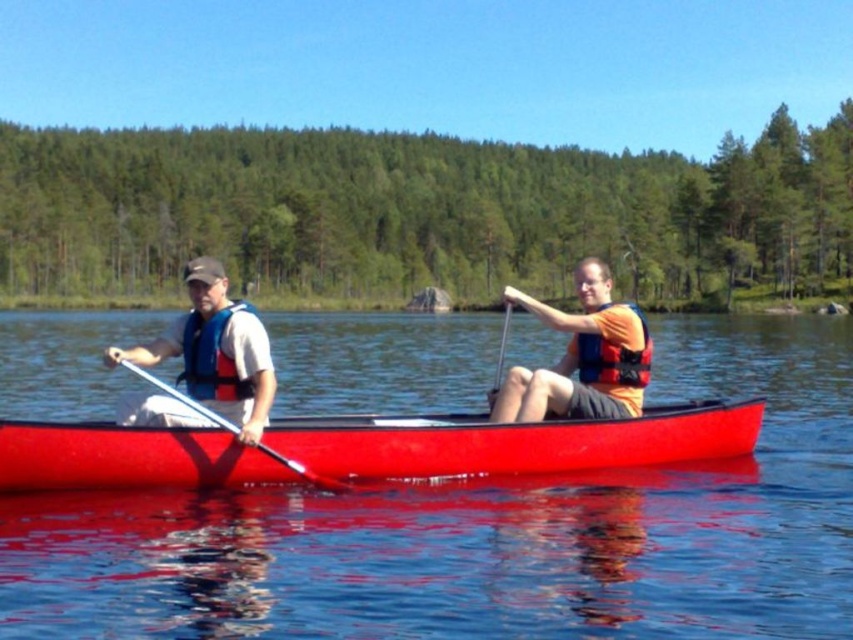
Question: Does matte blue life vest at left come in front of orange fabric life jacket at center?

Choices:
 (A) yes
 (B) no

Answer: (A)

Question: Which object is closer to the camera taking this photo?

Choices:
 (A) blue fabric life jacket at left
 (B) orange fabric life jacket at center
 (C) matte blue life vest at left
 (D) transparent water at center

Answer: (D)

Question: Does transparent water at center lie in front of smooth red canoe at center?

Choices:
 (A) yes
 (B) no

Answer: (A)

Question: Which of these objects is positioned closest to the blue fabric life jacket at left?

Choices:
 (A) transparent water at center
 (B) metallic silver paddle at left

Answer: (B)

Question: In this image, where is transparent water at center located relative to orange life vest at center?

Choices:
 (A) below
 (B) above

Answer: (B)

Question: Based on their relative distances, which object is nearer to the smooth red canoe at center?

Choices:
 (A) orange fabric life jacket at center
 (B) orange life vest at center
 (C) transparent water at center
 (D) matte blue life vest at left

Answer: (A)